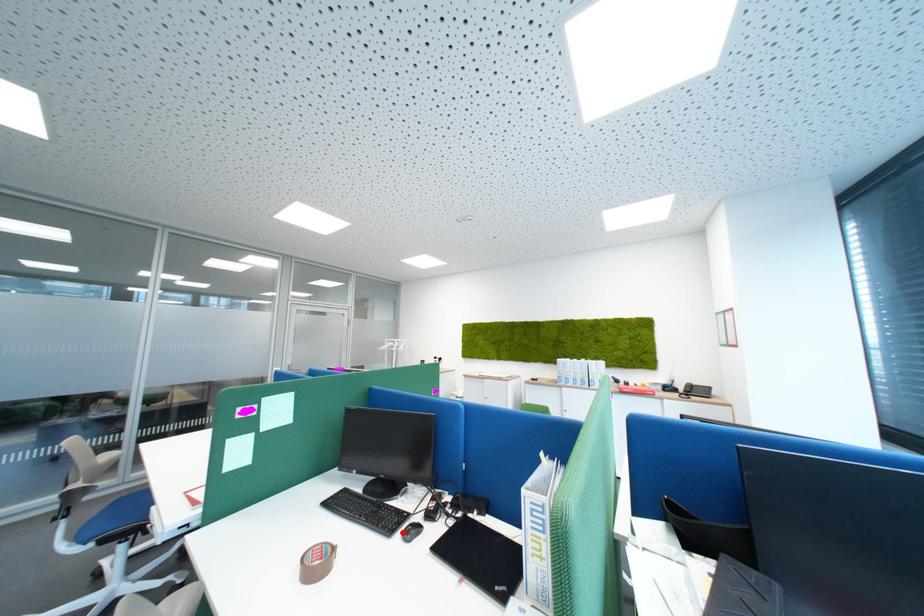
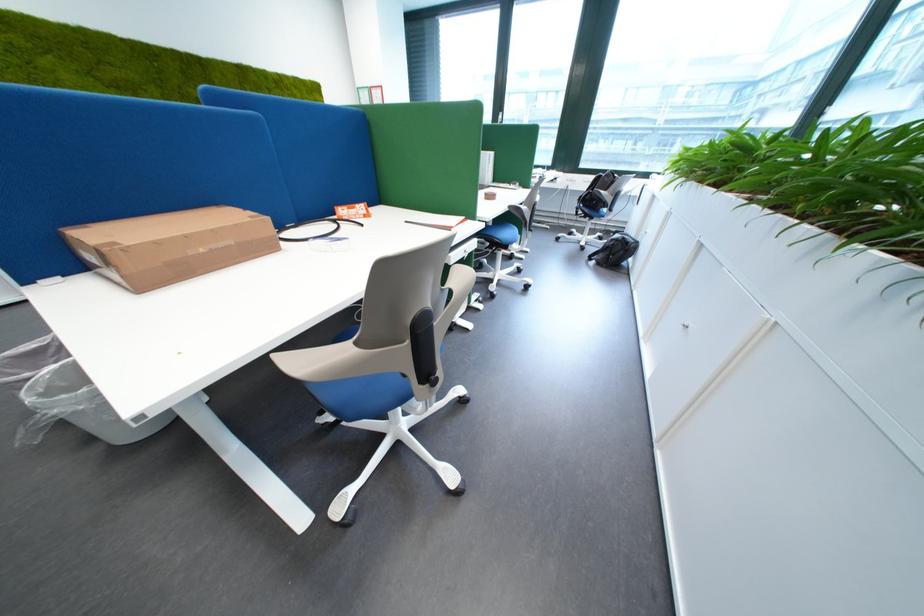
Question: I am providing you with two images of the same scene from different viewpoints. A red point is marked on the first image. At the location where the point appears in image 1, is it still visible in image 2?

Choices:
 (A) Yes
 (B) No

Answer: (B)